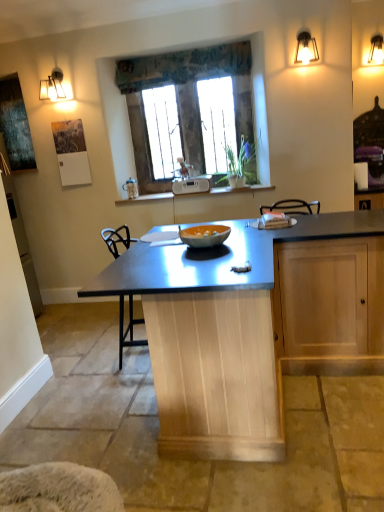
Question: In the image, is stone textured window at center positioned in front of or behind metallic blue table at center?

Choices:
 (A) front
 (B) behind

Answer: (B)

Question: From the image's perspective, is stone textured window at center located above or below metallic blue table at center?

Choices:
 (A) above
 (B) below

Answer: (A)

Question: Which of these objects is positioned closest to the textured fabric valance at upper center?

Choices:
 (A) metallic blue table at center
 (B) stone textured window at center
 (C) white plastic radio at center
 (D) orange matte glass bowl at center
 (E) metallic wall sconce at upper right

Answer: (B)

Question: Which object is positioned closest to the metallic wall sconce at upper right?

Choices:
 (A) metallic blue table at center
 (B) orange matte glass bowl at center
 (C) textured fabric valance at upper center
 (D) stone textured window at center
 (E) white plastic radio at center

Answer: (C)